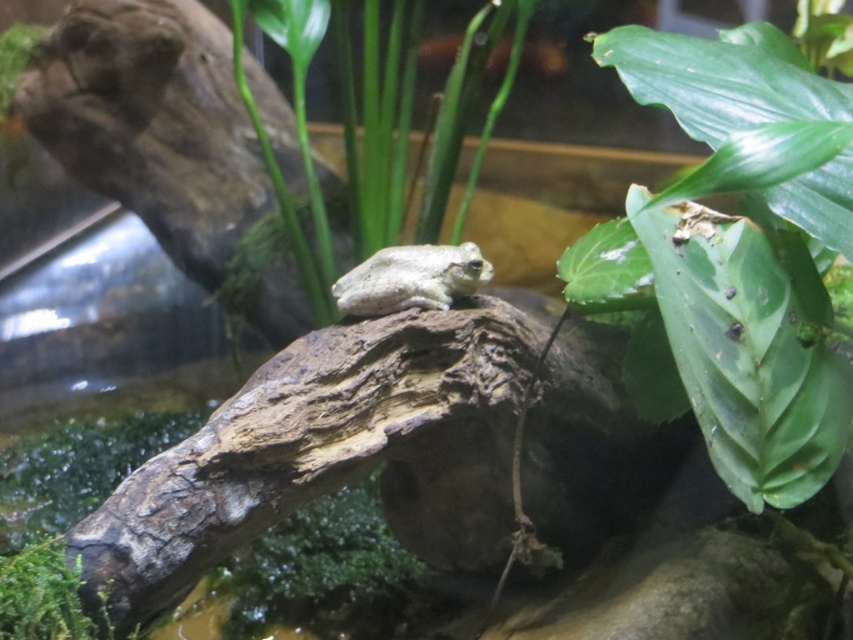
You are a small insect in the terrarium. You want to hide behind an object to avoid the frog. Which object would you choose between the green leafy plant at center and the gray matte frog at center, and why?

You should hide behind the green leafy plant at center because its width is larger than the gray matte frog at center, providing better coverage.